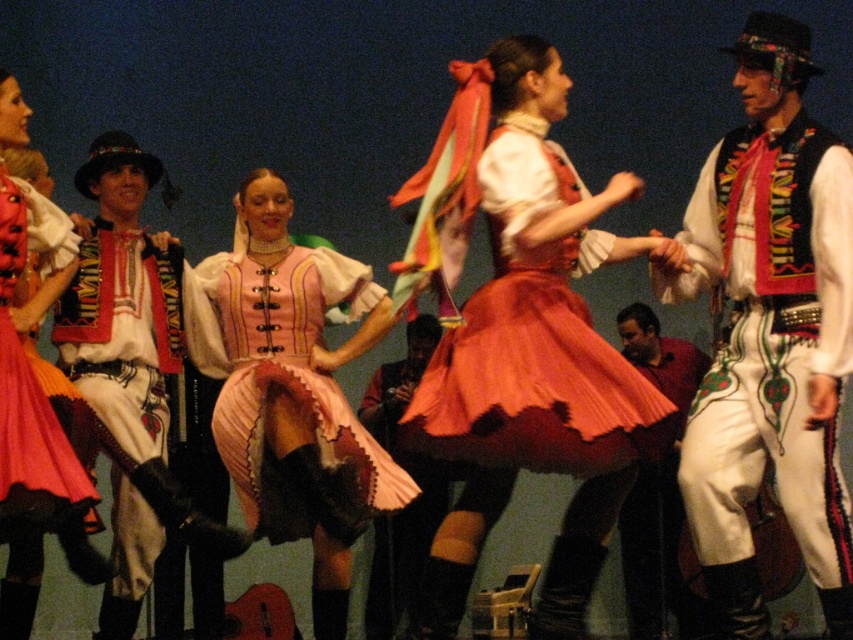
Question: Can you confirm if pink satin dress at center is positioned above matte white pants at center?

Choices:
 (A) no
 (B) yes

Answer: (B)

Question: Which point is closer to the camera?

Choices:
 (A) click(79, 531)
 (B) click(180, 330)
 (C) click(805, 403)
 (D) click(682, 600)

Answer: (C)

Question: Can you confirm if white cotton shirt at left is positioned below matte white pants at center?

Choices:
 (A) no
 (B) yes

Answer: (A)

Question: Is matte orange skirt at center positioned at the back of matte white pants at center?

Choices:
 (A) no
 (B) yes

Answer: (A)

Question: Considering the real-world distances, which object is closest to the dark red fabric at center?

Choices:
 (A) pink satin dress at center
 (B) matte orange skirt at center
 (C) white satin vest at right
 (D) white cotton shirt at left

Answer: (A)

Question: Among these objects, which one is farthest from the camera?

Choices:
 (A) matte orange skirt at center
 (B) white satin vest at right
 (C) matte black dress at left

Answer: (C)